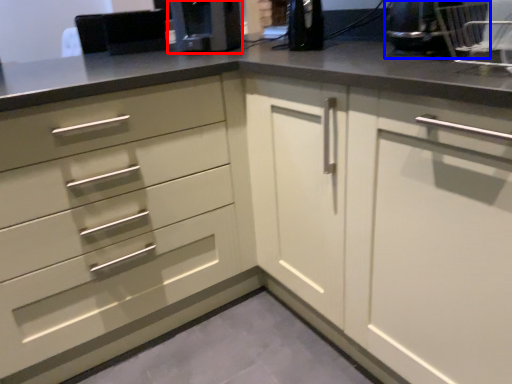
Question: Among these objects, which one is farthest to the camera, coffee machine (highlighted by a red box) or appliance (highlighted by a blue box)?

Choices:
 (A) coffee machine
 (B) appliance

Answer: (A)